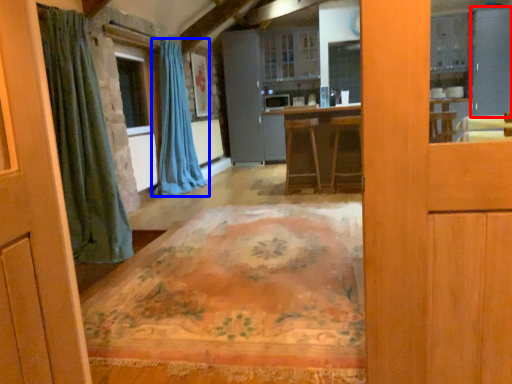
Question: Among these objects, which one is farthest to the camera, screen door (highlighted by a red box) or curtain (highlighted by a blue box)?

Choices:
 (A) screen door
 (B) curtain

Answer: (A)